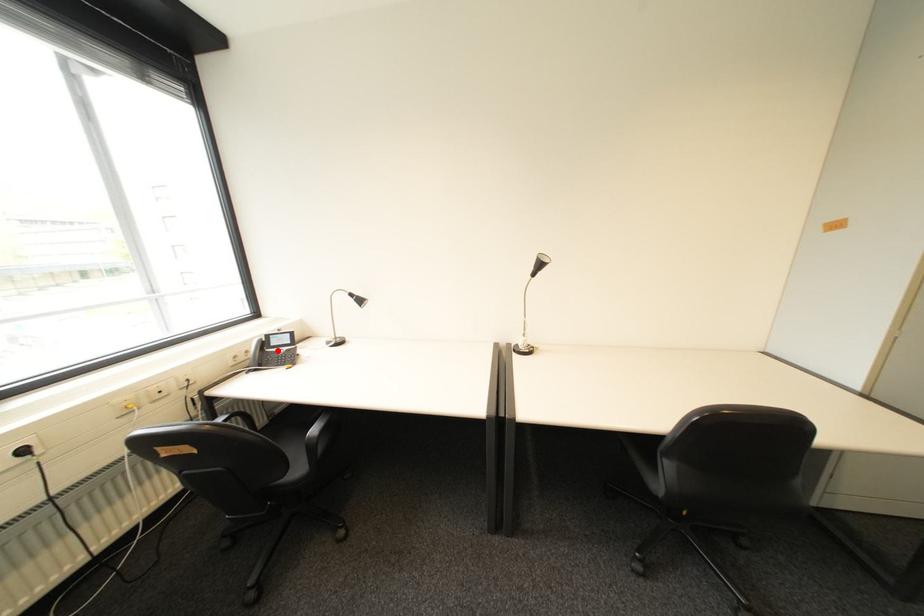
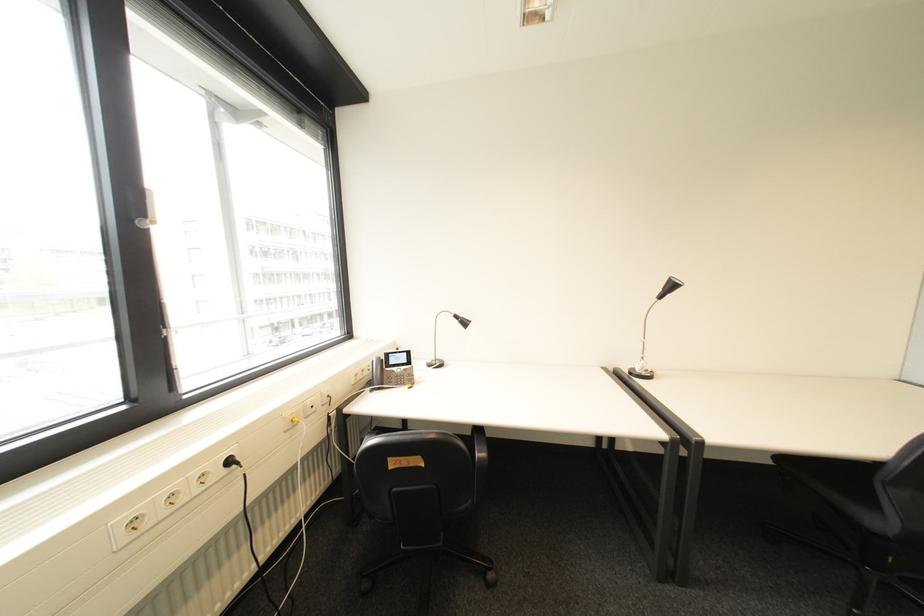
Locate, in the second image, the point that corresponds to the highlighted location in the first image.

(396, 370)